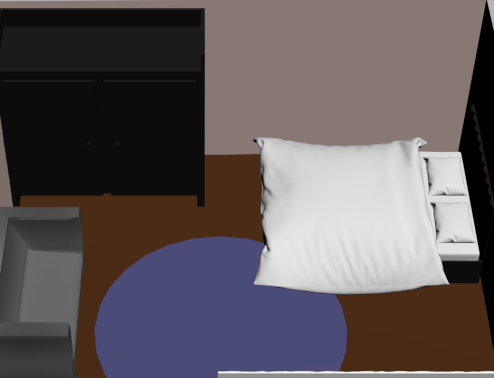
Identify the location of handles. The image size is (494, 378). (117, 142), (90, 144).